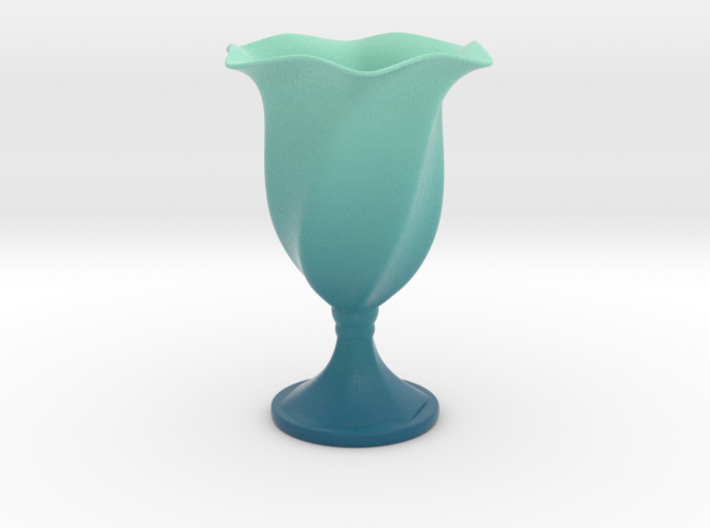
Where is `lip of cup`? lip of cup is located at coordinates (468, 60).